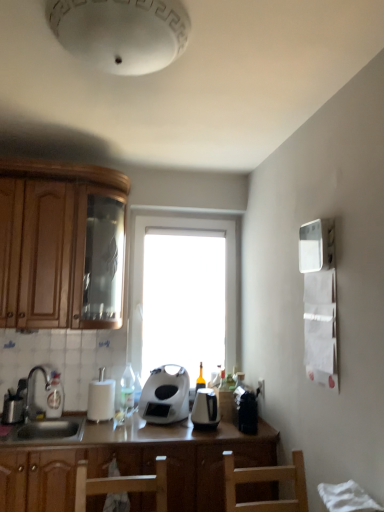
In order to click on vacant area that is situated to the right of translucent glass bottle at sink left, marked as the 2th bottle in a right-to-left arrangement in this screenshot , I will do `click(72, 419)`.